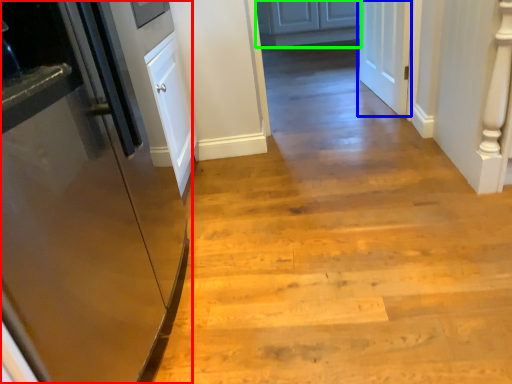
Question: Which is farther away from door (highlighted by a red box)? door (highlighted by a blue box) or cabinetry (highlighted by a green box)?

Choices:
 (A) door
 (B) cabinetry

Answer: (B)